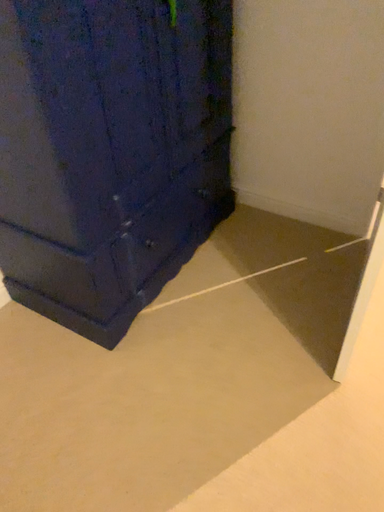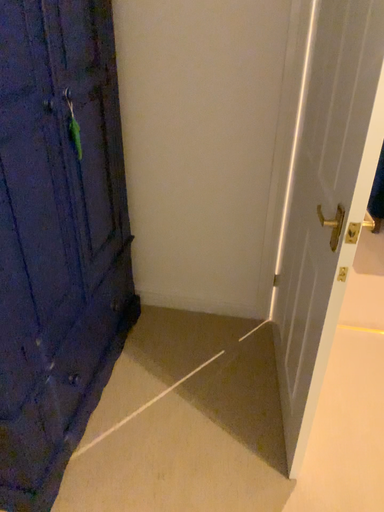
Question: Which way did the camera rotate in the video?

Choices:
 (A) rotated right
 (B) rotated left

Answer: (A)